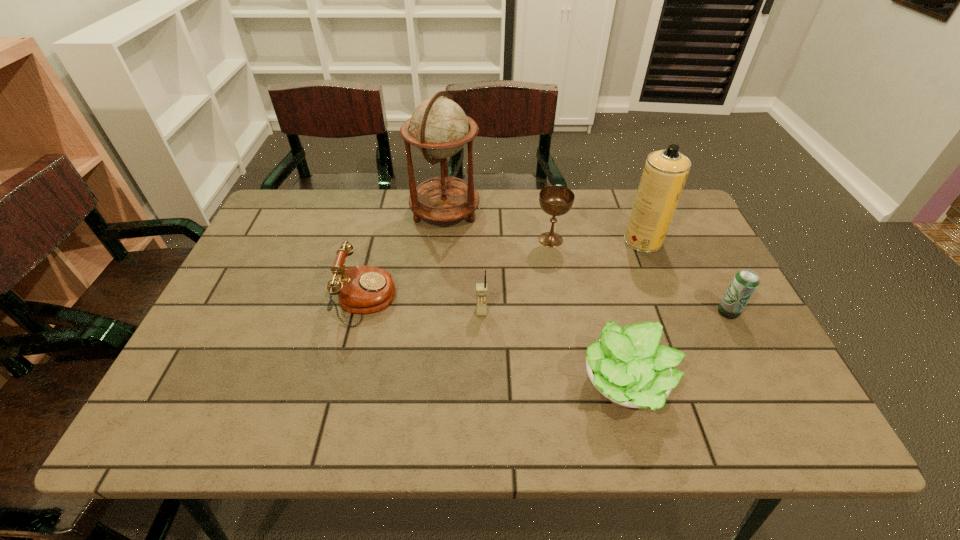
The height and width of the screenshot is (540, 960). In order to click on aerosol can positioned at the right edge in this screenshot , I will do `click(665, 172)`.

Identify the location of beer can situated at the right edge. This screenshot has height=540, width=960. (745, 282).

The height and width of the screenshot is (540, 960). I want to click on object at the far right corner, so (x=665, y=172).

This screenshot has height=540, width=960. What are the coordinates of `vacant space at the far edge` in the screenshot? It's located at (499, 219).

I want to click on vacant space at the left edge of the desktop, so click(x=300, y=240).

At what (x,y) coordinates should I click in order to perform the action: click on vacant region at the right edge of the desktop. Please return your answer as a coordinate pair (x, y). This screenshot has height=540, width=960. Looking at the image, I should click on (683, 259).

Image resolution: width=960 pixels, height=540 pixels. Find the location of `free space at the far left corner of the desktop`. free space at the far left corner of the desktop is located at coordinates (277, 235).

Find the location of a particular element. free space at the near left corner of the desktop is located at coordinates [223, 400].

Find the location of a particular element. The image size is (960, 540). vacant space at the far right corner of the desktop is located at coordinates (697, 227).

At what (x,y) coordinates should I click in order to perform the action: click on vacant space in between the beer can and the telephone. Please return your answer as a coordinate pair (x, y). Image resolution: width=960 pixels, height=540 pixels. Looking at the image, I should click on (547, 306).